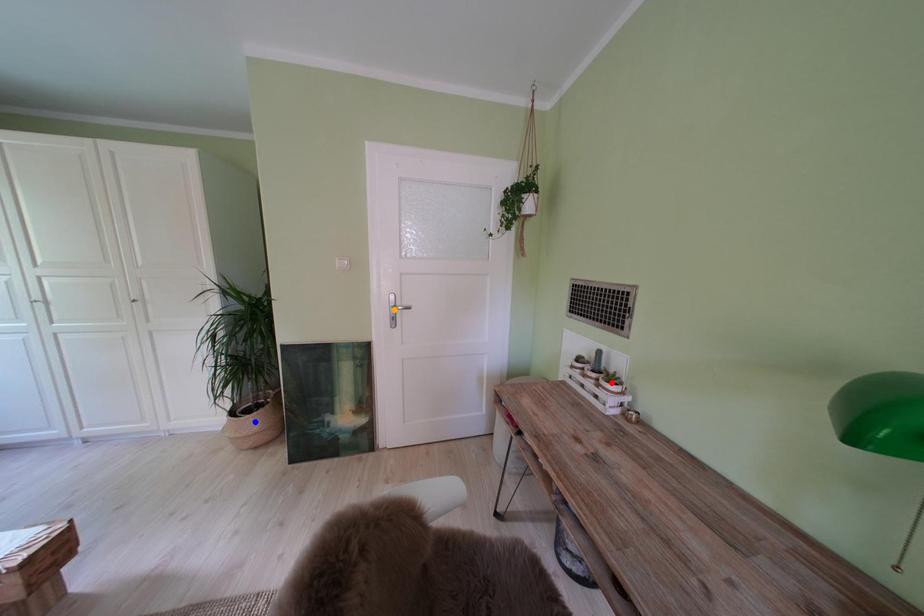
Order these from nearest to farthest:
A) red point
B) blue point
C) orange point

red point < orange point < blue point